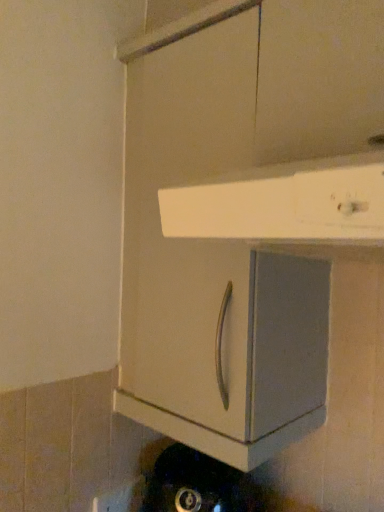
At what (x,y) coordinates should I click in order to perform the action: click on white matte cabinet at upper center. Please return your answer as a coordinate pair (x, y). The width and height of the screenshot is (384, 512). Looking at the image, I should click on (285, 204).

What is the approximate height of white matte cabinet at upper center?

It is 5.26 inches.

What is the approximate width of white matte cabinet at upper center?

19.82 inches.

In order to face white matte cabinet at upper center, should I rotate leftwards or rightwards?

To face it directly, rotate right by 19.096 degrees.

What do you see at coordinates (285, 204) in the screenshot?
I see `white matte cabinet at upper center` at bounding box center [285, 204].

At what (x,y) coordinates should I click in order to perform the action: click on white matte cabinet at upper center. Please return your answer as a coordinate pair (x, y). Looking at the image, I should click on (285, 204).